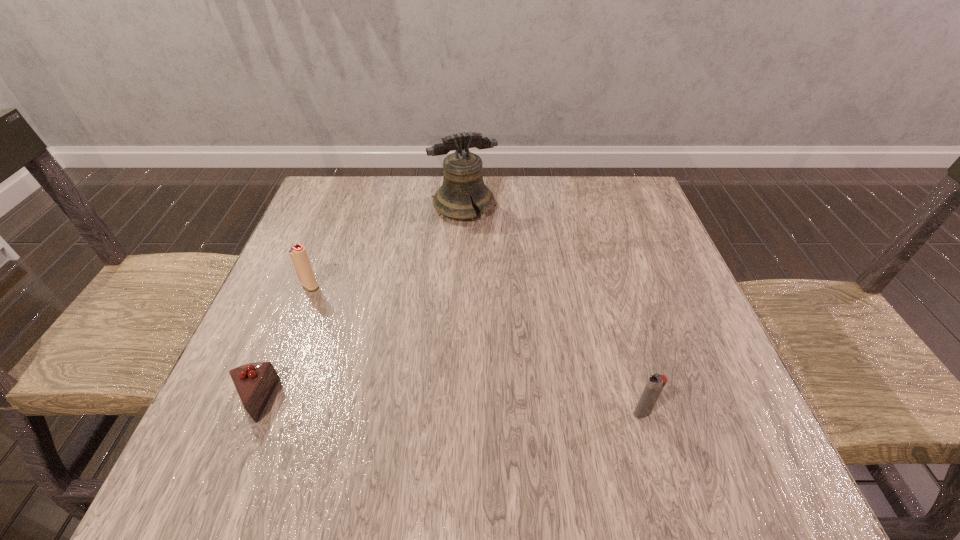
In order to click on vacant space at the far right corner of the desktop in this screenshot , I will do `click(590, 197)`.

Find the location of a particular element. The width and height of the screenshot is (960, 540). vacant area that lies between the farthest object and the chocolate cake is located at coordinates (359, 303).

The image size is (960, 540). Find the location of `empty space between the farther igniter and the farthest object`. empty space between the farther igniter and the farthest object is located at coordinates click(x=387, y=246).

This screenshot has height=540, width=960. I want to click on empty space between the rightmost object and the bell, so click(x=553, y=309).

This screenshot has height=540, width=960. Find the location of `vacant area between the nearer igniter and the bell`. vacant area between the nearer igniter and the bell is located at coordinates (553, 309).

At what (x,y) coordinates should I click in order to perform the action: click on vacant space that's between the tallest object and the left igniter. Please return your answer as a coordinate pair (x, y). Looking at the image, I should click on (387, 246).

Find the location of a particular element. unoccupied position between the bell and the rightmost object is located at coordinates (553, 309).

Locate an element on the screen. The height and width of the screenshot is (540, 960). empty space that is in between the bell and the chocolate cake is located at coordinates (359, 303).

I want to click on vacant region between the chocolate cake and the farther igniter, so click(281, 343).

Locate an element on the screen. free space between the chocolate cake and the right igniter is located at coordinates (447, 407).